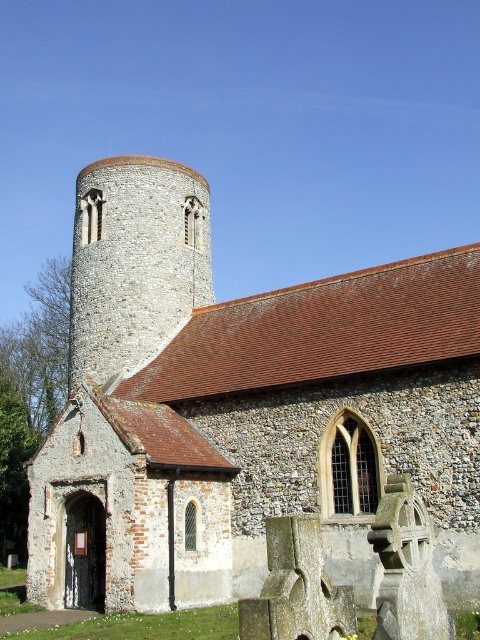
You are a maintenance worker needing to reach the stone tower at center from the stone church at center. Given that your ladder is 6 meters long, will it be sufficient to bridge the gap between them?

The distance between the stone church at center and the stone tower at center is 5.98 meters. Since the ladder is 6 meters long, it will be sufficient to bridge the gap between them.

You are standing in front of the historic stone church and want to take a photo that includes both the stone church at center and the stone tower at center. Which direction should you move to ensure both are visible in your camera frame?

You should move to the left so that the stone church at center, which is to the right of the stone tower at center, can be captured along with the tower in your camera frame.

You are a tour guide explaining the architecture of the stone church at center and the stone tower at center. Which one would you mention is bigger?

The stone church at center is larger in size than the stone tower at center.